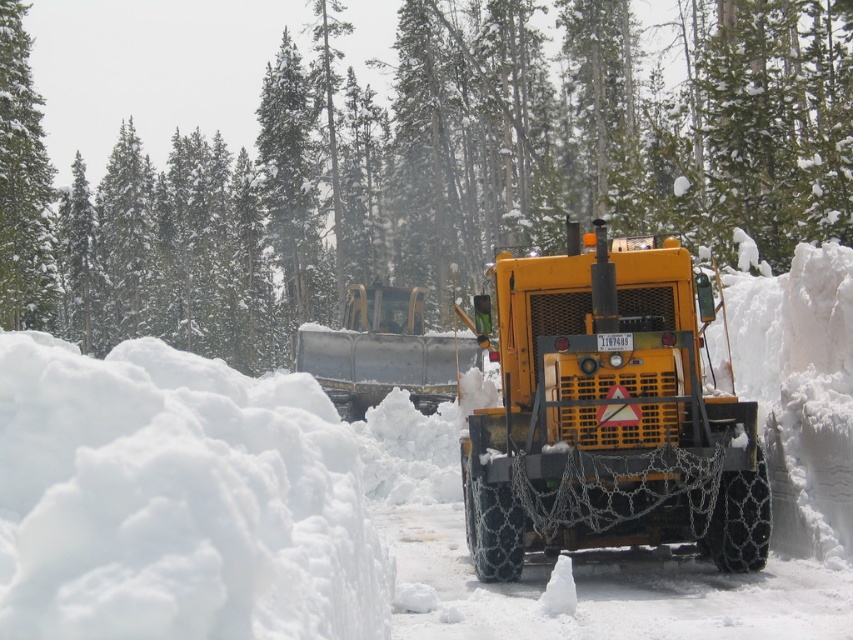
You are standing at the point marked as point (54, 573) in a snowy forest scene where two snowplows are clearing a road. You want to move to the yellow snowplow with license plate 1167489. Is the yellow snowplow within a 3 meter radius from your current position?

The distance between point (54, 573) and the viewer is 2.96 meters, which is within the 3 meter radius. Therefore, the yellow snowplow with license plate 1167489 is within the 3 meter radius from your current position.

You are a hiker trying to reach a cabin located behind the green textured pine at center and the white fluffy snow at left. Which object would you need to go around first?

You would need to go around the green textured pine at center first because it is closer to you than the white fluffy snow at left, so you encounter it sooner.